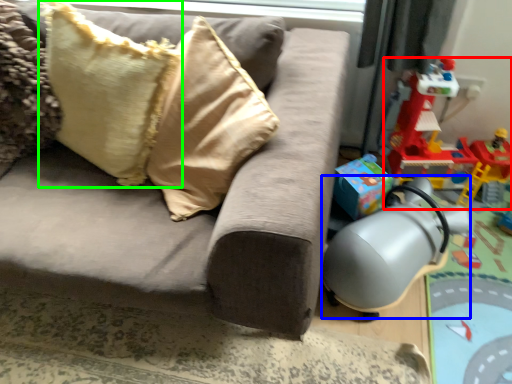
Question: Based on their relative distances, which object is farther from toy (highlighted by a red box)? Choose from swivel chair (highlighted by a blue box) and pillow (highlighted by a green box).

Choices:
 (A) swivel chair
 (B) pillow

Answer: (B)